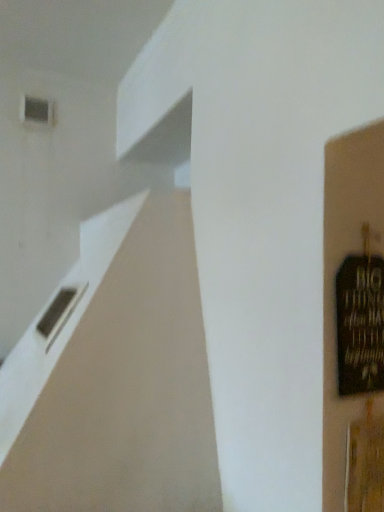
You are a GUI agent. You are given a task and a screenshot of the screen. Output one action in this format:
    pyautogui.click(x=<x>, y=<y>)
    Task: Click on the dark brown wooden sign at right
    The image size is (384, 512).
    Given the screenshot: What is the action you would take?
    pyautogui.click(x=360, y=324)

The height and width of the screenshot is (512, 384). Describe the element at coordinates (360, 324) in the screenshot. I see `dark brown wooden sign at right` at that location.

Where is `dark brown wooden sign at right`? This screenshot has height=512, width=384. dark brown wooden sign at right is located at coordinates (360, 324).